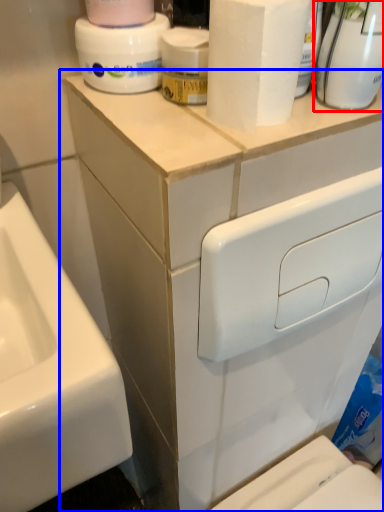
Question: Which object appears farthest to the camera in this image, cleaning product (highlighted by a red box) or bathroom cabinet (highlighted by a blue box)?

Choices:
 (A) cleaning product
 (B) bathroom cabinet

Answer: (B)